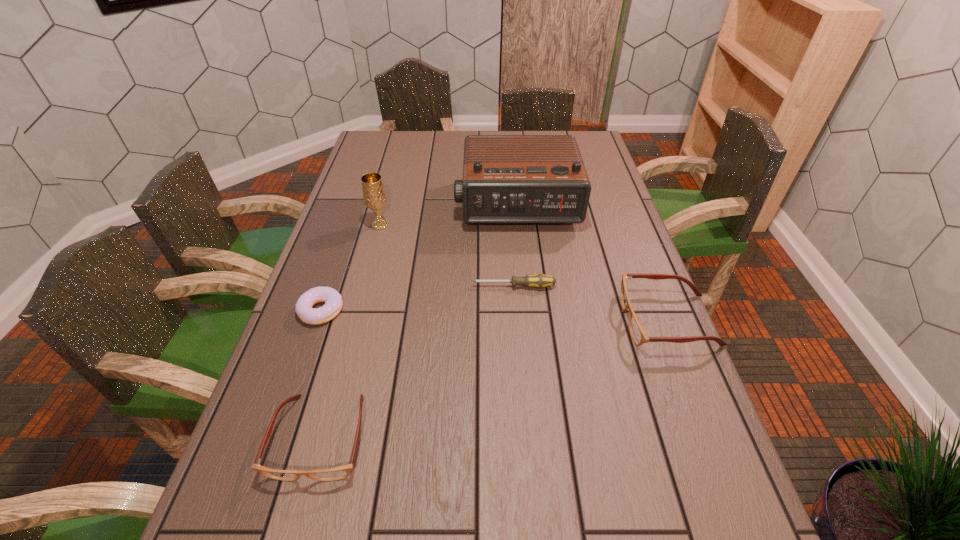
Identify the location of the fourth tallest object. This screenshot has height=540, width=960. (340, 472).

I want to click on the left spectacles, so click(x=340, y=472).

This screenshot has height=540, width=960. What are the coordinates of `the rightmost object` in the screenshot? It's located at (638, 334).

This screenshot has width=960, height=540. I want to click on the right spectacles, so click(x=638, y=334).

This screenshot has height=540, width=960. Identify the location of chalice. (374, 196).

Identify the location of the tallest object. (506, 178).

Locate an element on the screen. doughnut is located at coordinates (303, 308).

Identify the location of screwdriver. pos(539,281).

Where is `free space located 0.180m on the front-facing side of the right spectacles`? free space located 0.180m on the front-facing side of the right spectacles is located at coordinates (551, 320).

This screenshot has width=960, height=540. Identify the location of vacant space located on the front-facing side of the right spectacles. (475, 320).